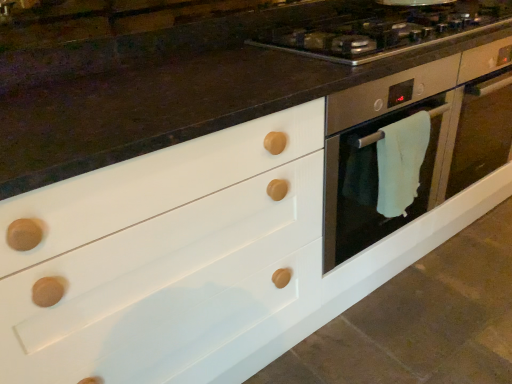
Question: Can you confirm if satin silver gas stove at upper center is shorter than white towel at right?

Choices:
 (A) yes
 (B) no

Answer: (A)

Question: Is satin silver gas stove at upper center behind white towel at right?

Choices:
 (A) no
 (B) yes

Answer: (A)

Question: Is satin silver gas stove at upper center taller than white towel at right?

Choices:
 (A) yes
 (B) no

Answer: (B)

Question: Would you say satin silver gas stove at upper center contains white towel at right?

Choices:
 (A) no
 (B) yes

Answer: (A)

Question: Does satin silver gas stove at upper center have a greater width compared to white towel at right?

Choices:
 (A) yes
 (B) no

Answer: (A)

Question: Considering the positions of satin silver gas stove at upper center and white towel at right in the image, is satin silver gas stove at upper center taller or shorter than white towel at right?

Choices:
 (A) tall
 (B) short

Answer: (B)

Question: Considering the positions of point (385, 46) and point (385, 201), is point (385, 46) closer or farther from the camera than point (385, 201)?

Choices:
 (A) closer
 (B) farther

Answer: (B)

Question: From the image's perspective, is satin silver gas stove at upper center above or below white towel at right?

Choices:
 (A) above
 (B) below

Answer: (A)

Question: From a real-world perspective, is satin silver gas stove at upper center physically located above or below white towel at right?

Choices:
 (A) below
 (B) above

Answer: (B)

Question: Based on their positions, is satin silver oven at center right located to the left or right of satin silver gas stove at upper center?

Choices:
 (A) left
 (B) right

Answer: (B)

Question: In terms of size, does satin silver oven at center right appear bigger or smaller than satin silver gas stove at upper center?

Choices:
 (A) small
 (B) big

Answer: (B)

Question: Is point (335, 115) closer or farther from the camera than point (392, 43)?

Choices:
 (A) closer
 (B) farther

Answer: (A)

Question: Considering their positions, is satin silver oven at center right located in front of or behind satin silver gas stove at upper center?

Choices:
 (A) front
 (B) behind

Answer: (B)

Question: Is satin silver gas stove at upper center in front of or behind satin silver oven at center right in the image?

Choices:
 (A) front
 (B) behind

Answer: (A)

Question: In terms of height, does satin silver gas stove at upper center look taller or shorter compared to satin silver oven at center right?

Choices:
 (A) short
 (B) tall

Answer: (A)